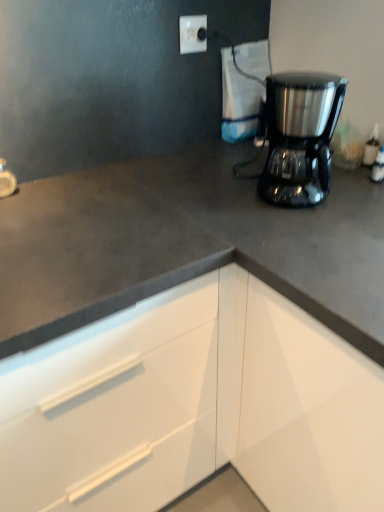
Question: From their relative heights in the image, would you say white glossy cabinet at lower right is taller or shorter than white plastic electric outlet at upper center?

Choices:
 (A) short
 (B) tall

Answer: (B)

Question: Is white glossy cabinet at lower right in front of or behind white plastic electric outlet at upper center in the image?

Choices:
 (A) front
 (B) behind

Answer: (A)

Question: Estimate the real-world distances between objects in this image. Which object is closer to the white plastic electric outlet at upper center?

Choices:
 (A) white glossy cabinet at lower right
 (B) satin black coffee maker at upper right
 (C) white glossy faucet at upper left

Answer: (B)

Question: Estimate the real-world distances between objects in this image. Which object is closer to the satin black coffee maker at upper right?

Choices:
 (A) white plastic electric outlet at upper center
 (B) white glossy cabinet at lower right
 (C) white glossy faucet at upper left

Answer: (A)